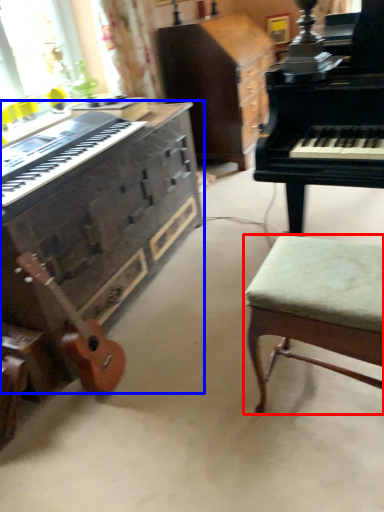
Question: Which point is closer to the camera, stool (highlighted by a red box) or piano (highlighted by a blue box)?

Choices:
 (A) stool
 (B) piano

Answer: (A)